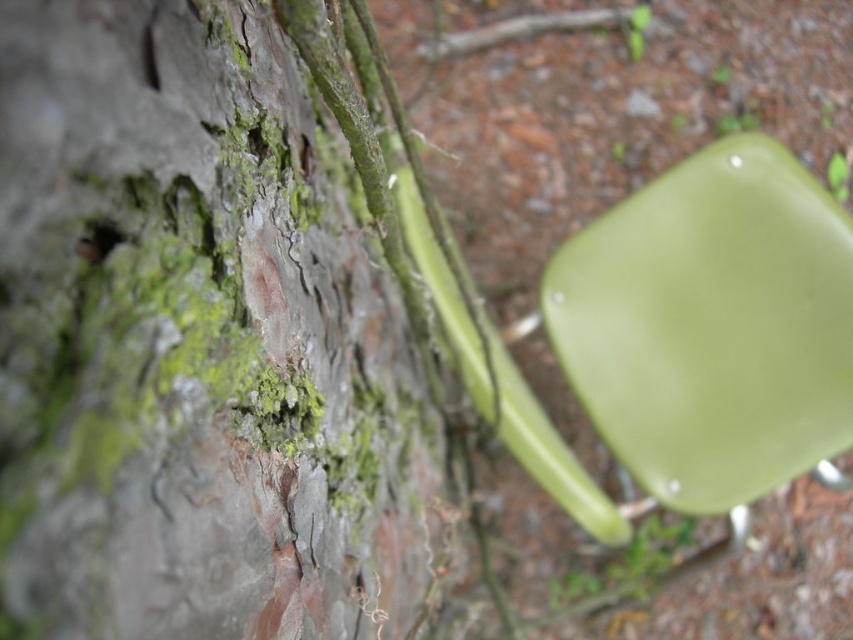
Please provide the 2D coordinates of the green matte tree trunk at center in the image. The answer should be in the format of a point with two decimal places, like this example format point format example point format example point format example point format example point format example point format example point format example point format example point format example point format example point format example point format example point format example point format example point format example point format.

The 2D coordinates of the green matte tree trunk at center are at point [195,342].